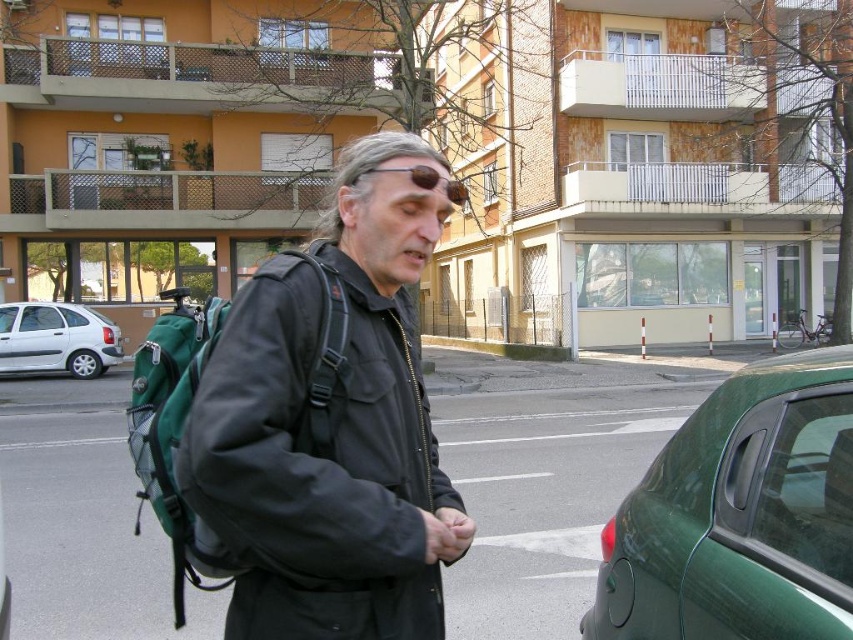
You are standing at the point with coordinates point (x=100, y=349) and want to walk to the point with coordinates point (x=357, y=339). Which direction should you walk to reach your destination?

You should walk forward because point (x=357, y=339) is in front of point (x=100, y=349).

In the scene shown: You are a delivery person who needs to place the matte black backpack at center into the trunk of the white matte car at left. Can the backpack fit inside the trunk based on their sizes?

The matte black backpack at center has a width less than the white matte car at left, so it should fit inside the trunk.